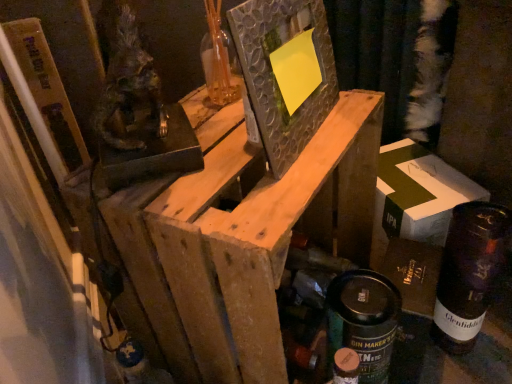
The width and height of the screenshot is (512, 384). I want to click on empty space that is ontop of white cardboard box at right (from a real-world perspective), so click(418, 177).